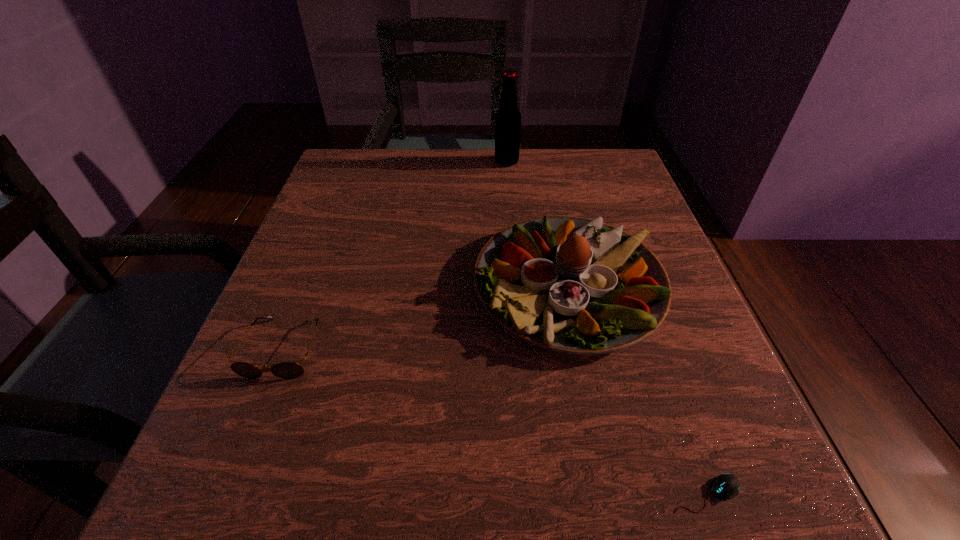
Locate an element on the screen. This screenshot has width=960, height=540. vacant space at the near right corner of the desktop is located at coordinates (699, 497).

You are a GUI agent. You are given a task and a screenshot of the screen. Output one action in this format:
    pyautogui.click(x=<x>, y=<y>)
    Task: Click on the vacant point located between the mouse and the third shortest object
    
    Given the screenshot: What is the action you would take?
    pyautogui.click(x=637, y=389)

Find the location of a particular element. This screenshot has width=960, height=540. free space between the salad plate and the leftmost object is located at coordinates (426, 318).

Locate an element on the screen. free space between the sunglasses and the mouse is located at coordinates (494, 421).

Where is `free space between the farthest object and the sunglasses`? free space between the farthest object and the sunglasses is located at coordinates (395, 255).

Where is `free spot between the sunglasses and the tallest object`? This screenshot has height=540, width=960. free spot between the sunglasses and the tallest object is located at coordinates (395, 255).

Where is `empty location between the shortest object and the sunglasses`? Image resolution: width=960 pixels, height=540 pixels. empty location between the shortest object and the sunglasses is located at coordinates [494, 421].

The width and height of the screenshot is (960, 540). Find the location of `free space that is in between the second shortest object and the third shortest object`. free space that is in between the second shortest object and the third shortest object is located at coordinates (426, 318).

Locate an element on the screen. Image resolution: width=960 pixels, height=540 pixels. vacant area that lies between the second tallest object and the mouse is located at coordinates (637, 389).

At what (x,y) coordinates should I click in order to perform the action: click on the closest object to the second shortest object. Please return your answer as a coordinate pair (x, y). The width and height of the screenshot is (960, 540). Looking at the image, I should click on (569, 284).